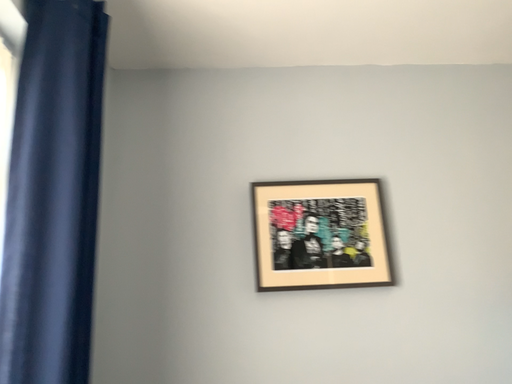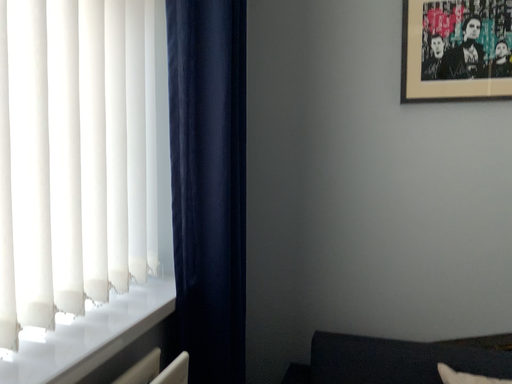
Question: How did the camera likely rotate when shooting the video?

Choices:
 (A) rotated right
 (B) rotated left

Answer: (B)